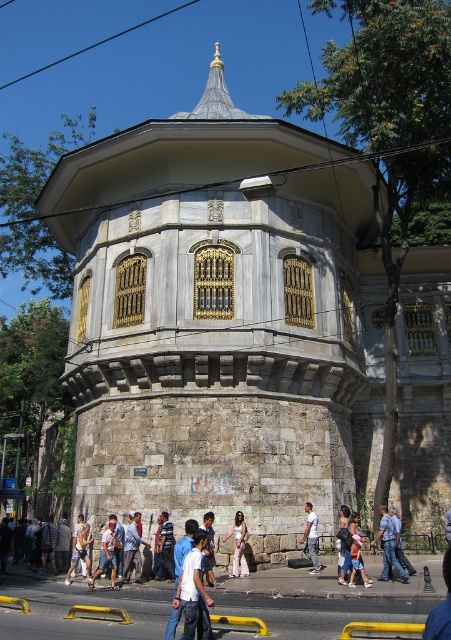
Question: Which point is farther to the camera?

Choices:
 (A) (307, 518)
 (B) (182, 586)
 (C) (391, 561)

Answer: (A)

Question: Which of the following is the closest to the observer?

Choices:
 (A) light blue jeans at center
 (B) blue jeans at lower right

Answer: (B)

Question: Does stone tower at center have a smaller size compared to light blue jeans at center?

Choices:
 (A) yes
 (B) no

Answer: (B)

Question: Which point is farther from the camera taking this photo?

Choices:
 (A) (235, 550)
 (B) (311, 520)
 (C) (139, 518)
 (D) (69, 353)

Answer: (D)

Question: Does blue denim jeans at center appear over denim jeans at center?

Choices:
 (A) no
 (B) yes

Answer: (A)

Question: Is denim jeans at center behind pink fabric dress at center?

Choices:
 (A) yes
 (B) no

Answer: (B)